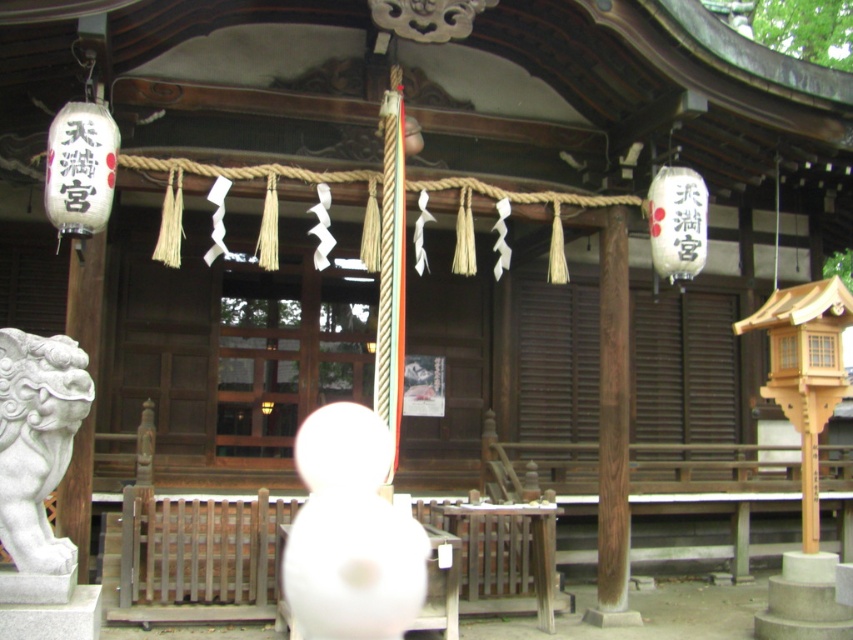
Question: Which of the following is the farthest from the observer?

Choices:
 (A) white paper lantern at left
 (B) white paper lantern at upper right

Answer: (B)

Question: Which point appears farthest from the camera in this image?

Choices:
 (A) (10, 445)
 (B) (111, 147)

Answer: (B)

Question: Which point is closer to the camera?

Choices:
 (A) tap(39, 540)
 (B) tap(80, 168)

Answer: (A)

Question: Considering the relative positions of white paper lantern at left and white paper lantern at upper right in the image provided, where is white paper lantern at left located with respect to white paper lantern at upper right?

Choices:
 (A) above
 (B) below

Answer: (A)

Question: Is white stone lion at left positioned behind white paper lantern at left?

Choices:
 (A) yes
 (B) no

Answer: (B)

Question: Is white stone lion at left closer to camera compared to white paper lantern at upper right?

Choices:
 (A) yes
 (B) no

Answer: (A)